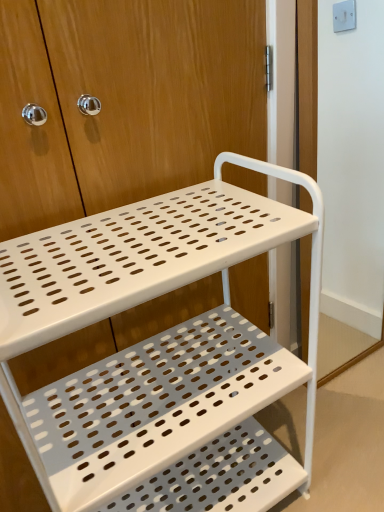
Question: From a real-world perspective, does white perforated metal cart at center sit lower than white matte screen door at right?

Choices:
 (A) no
 (B) yes

Answer: (B)

Question: Is white perforated metal cart at center in front of white matte screen door at right?

Choices:
 (A) no
 (B) yes

Answer: (B)

Question: Is white perforated metal cart at center shorter than white matte screen door at right?

Choices:
 (A) yes
 (B) no

Answer: (A)

Question: Does white perforated metal cart at center have a greater height compared to white matte screen door at right?

Choices:
 (A) no
 (B) yes

Answer: (A)

Question: Can we say white perforated metal cart at center lies outside white matte screen door at right?

Choices:
 (A) yes
 (B) no

Answer: (A)

Question: Is white perforated metal cart at center surrounding white matte screen door at right?

Choices:
 (A) no
 (B) yes

Answer: (A)

Question: From the image's perspective, does white matte screen door at right appear lower than white perforated metal cart at center?

Choices:
 (A) yes
 (B) no

Answer: (B)

Question: From a real-world perspective, is white matte screen door at right located higher than white perforated metal cart at center?

Choices:
 (A) yes
 (B) no

Answer: (A)

Question: Does white matte screen door at right come in front of white perforated metal cart at center?

Choices:
 (A) yes
 (B) no

Answer: (B)

Question: Is white matte screen door at right wider than white perforated metal cart at center?

Choices:
 (A) yes
 (B) no

Answer: (B)

Question: Considering the relative sizes of white matte screen door at right and white perforated metal cart at center in the image provided, is white matte screen door at right thinner than white perforated metal cart at center?

Choices:
 (A) yes
 (B) no

Answer: (A)

Question: Is white matte screen door at right facing towards white perforated metal cart at center?

Choices:
 (A) no
 (B) yes

Answer: (A)

Question: Considering the relative positions of white perforated metal cart at center and white matte screen door at right in the image provided, is white perforated metal cart at center to the left or to the right of white matte screen door at right?

Choices:
 (A) right
 (B) left

Answer: (B)